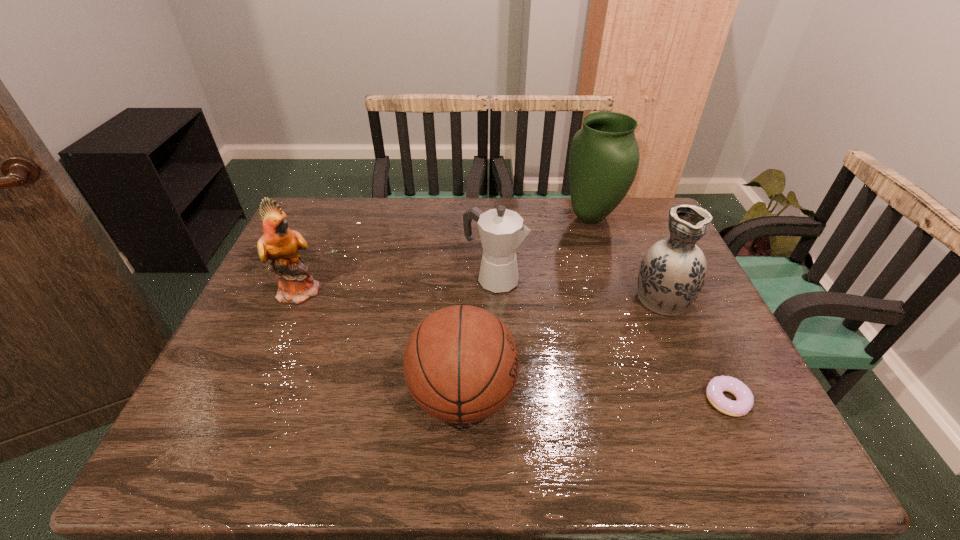
Where is `vacant space that's between the coffeepot and the taller vase`? This screenshot has height=540, width=960. vacant space that's between the coffeepot and the taller vase is located at coordinates (543, 248).

Locate an element on the screen. The height and width of the screenshot is (540, 960). free area in between the basketball and the shortest object is located at coordinates (595, 398).

This screenshot has width=960, height=540. Find the location of `unoccupied area between the shorter vase and the leftmost object`. unoccupied area between the shorter vase and the leftmost object is located at coordinates (481, 294).

Select which object appears as the second closest to the parrot. Please provide its 2D coordinates. Your answer should be formatted as a tuple, i.e. [(x, y)], where the tuple contains the x and y coordinates of a point satisfying the conditions above.

[(502, 231)]

Identify which object is the fifth nearest to the basketball. Please provide its 2D coordinates. Your answer should be formatted as a tuple, i.e. [(x, y)], where the tuple contains the x and y coordinates of a point satisfying the conditions above.

[(604, 155)]

The width and height of the screenshot is (960, 540). Identify the location of free space that satisfies the following two spatial constraints: 1. with the handle on the side of the shorter vase; 2. on the front-facing side of the leftmost object. (658, 290).

Find the location of `vacant space that satisfies the following two spatial constraints: 1. on the front-facing side of the parrot; 2. with the handle on the side of the shorter vase`. vacant space that satisfies the following two spatial constraints: 1. on the front-facing side of the parrot; 2. with the handle on the side of the shorter vase is located at coordinates (299, 298).